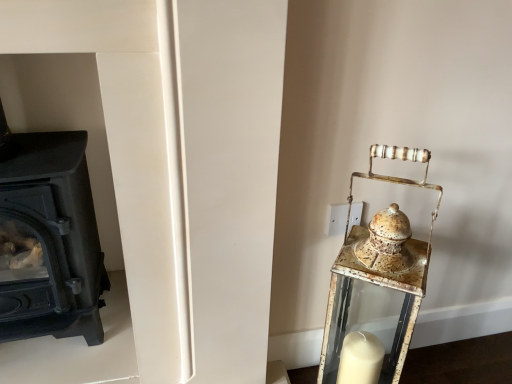
Question: Is black matte wood burning stove at left situated inside rusty metal lantern at right or outside?

Choices:
 (A) outside
 (B) inside

Answer: (A)

Question: In terms of width, does black matte wood burning stove at left look wider or thinner when compared to rusty metal lantern at right?

Choices:
 (A) thin
 (B) wide

Answer: (B)

Question: Considering the positions of black matte wood burning stove at left and rusty metal lantern at right in the image, is black matte wood burning stove at left bigger or smaller than rusty metal lantern at right?

Choices:
 (A) small
 (B) big

Answer: (B)

Question: Does point (394, 228) appear closer or farther from the camera than point (51, 319)?

Choices:
 (A) farther
 (B) closer

Answer: (B)

Question: Is rusty metal lantern at right bigger or smaller than black matte wood burning stove at left?

Choices:
 (A) big
 (B) small

Answer: (B)

Question: Is rusty metal lantern at right inside or outside of black matte wood burning stove at left?

Choices:
 (A) inside
 (B) outside

Answer: (B)

Question: In the image, is rusty metal lantern at right on the left side or the right side of black matte wood burning stove at left?

Choices:
 (A) right
 (B) left

Answer: (A)